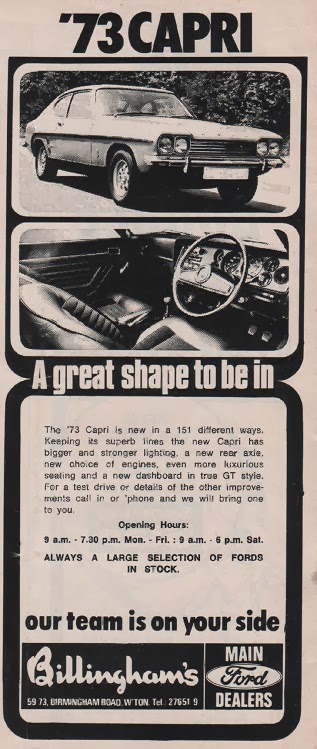
At what (x,y) coordinates should I click in order to perform the action: click on window lever. Please return your answer as a coordinate pair (x, y). The height and width of the screenshot is (749, 317). Looking at the image, I should click on (131, 264).